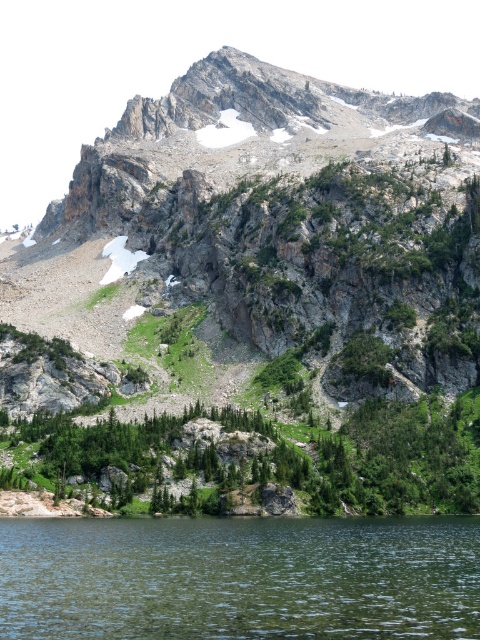
You are a hiker planning to cross the clear water at lower center. You notice the rocky gray mountain at upper center in the distance. Based on their widths, which one do you think is wider?

The rocky gray mountain at upper center might be wider than clear water at lower center, so it is likely wider.

You are a hiker standing at the base of the mountain. You see the point marked as point (259, 296). Which mountain feature does this point indicate?

The point (259, 296) indicates the location of the rocky gray mountain at upper center.